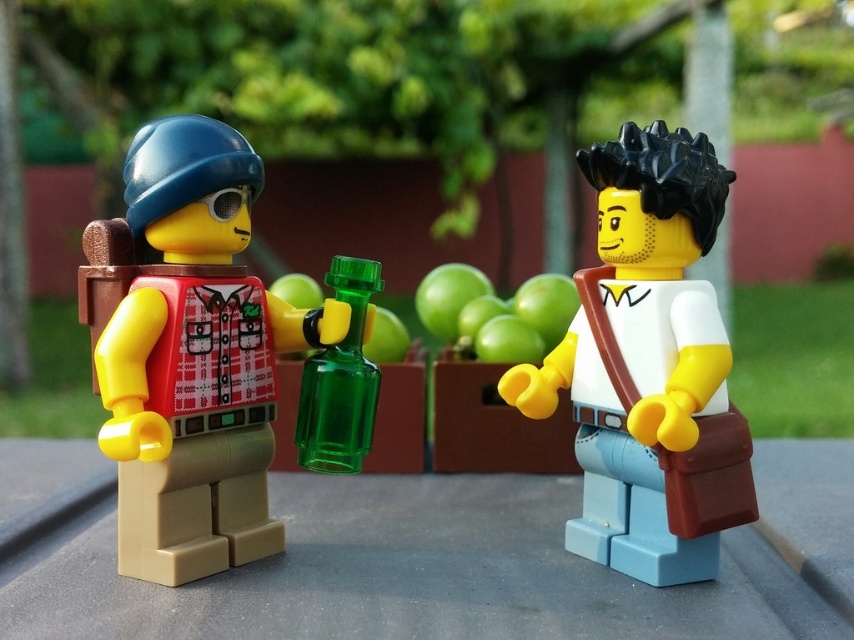
Can you confirm if smooth gray table at center is bigger than matte green glass bottle at left?

Yes, smooth gray table at center is bigger than matte green glass bottle at left.

Who is higher up, smooth gray table at center or matte green glass bottle at left?

matte green glass bottle at left

Is point (829, 557) less distant than point (243, 452)?

That is False.

Find the location of a particular element. The width and height of the screenshot is (854, 640). smooth gray table at center is located at coordinates (469, 566).

Can you confirm if smooth gray table at center is thinner than white matte shirt at center?

No.

Is smooth gray table at center behind white matte shirt at center?

No.

Image resolution: width=854 pixels, height=640 pixels. In order to click on smooth gray table at center in this screenshot , I will do `click(469, 566)`.

Where is `smooth gray table at center`? smooth gray table at center is located at coordinates (469, 566).

Can you confirm if white matte shirt at center is thinner than green translucent bottle at center?

No, white matte shirt at center is not thinner than green translucent bottle at center.

Is white matte shirt at center to the right of green translucent bottle at center from the viewer's perspective?

Correct, you'll find white matte shirt at center to the right of green translucent bottle at center.

The height and width of the screenshot is (640, 854). What do you see at coordinates (648, 365) in the screenshot?
I see `white matte shirt at center` at bounding box center [648, 365].

At what (x,y) coordinates should I click in order to perform the action: click on white matte shirt at center. Please return your answer as a coordinate pair (x, y). Image resolution: width=854 pixels, height=640 pixels. Looking at the image, I should click on (648, 365).